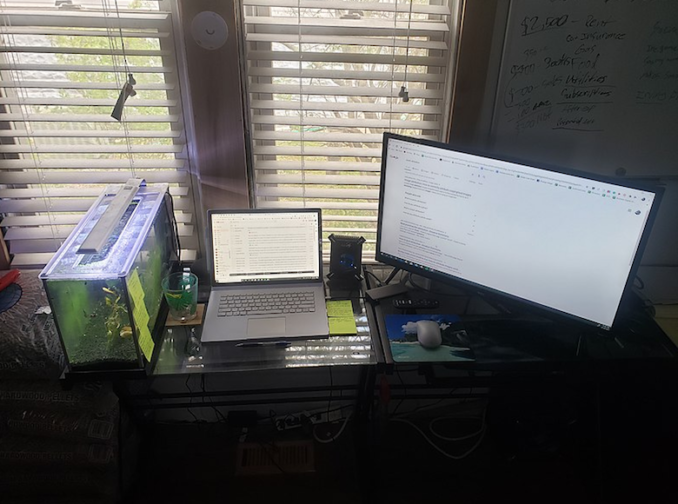
You are a GUI agent. You are given a task and a screenshot of the screen. Output one action in this format:
    pyautogui.click(x=<x>, y=<y>)
    Task: Click on the coaster
    
    Given the screenshot: What is the action you would take?
    pyautogui.click(x=169, y=322)